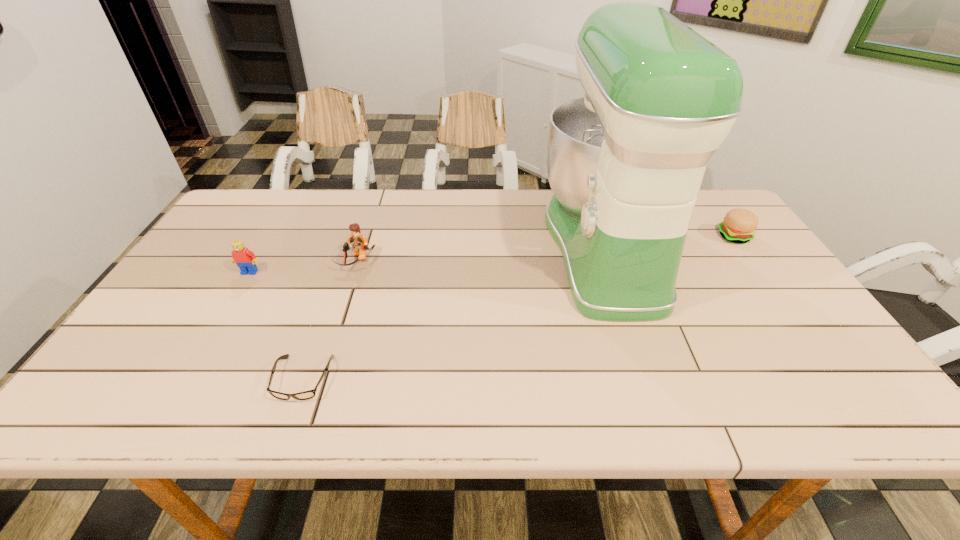
This screenshot has height=540, width=960. I want to click on free space between the tallest object and the leftmost object, so click(x=427, y=260).

Locate an element on the screen. The height and width of the screenshot is (540, 960). free space that is in between the fourth object from left to right and the right Lego is located at coordinates (480, 255).

Locate an element on the screen. The width and height of the screenshot is (960, 540). free space between the right Lego and the leftmost object is located at coordinates (302, 267).

The width and height of the screenshot is (960, 540). In order to click on free area in between the leftmost object and the right Lego in this screenshot , I will do `click(302, 267)`.

Find the location of a particular element. free point between the nearest object and the left Lego is located at coordinates (276, 325).

Identify which object is the fourth nearest to the right Lego. Please provide its 2D coordinates. Your answer should be formatted as a tuple, i.e. [(x, y)], where the tuple contains the x and y coordinates of a point satisfying the conditions above.

[(739, 225)]

Locate an element on the screen. The width and height of the screenshot is (960, 540). object that is the fourth closest to the shortest object is located at coordinates (739, 225).

This screenshot has width=960, height=540. Find the location of `vacant space that satisfies the following two spatial constraints: 1. on the controls of the second object from right to left; 2. on the face of the left Lego`. vacant space that satisfies the following two spatial constraints: 1. on the controls of the second object from right to left; 2. on the face of the left Lego is located at coordinates (612, 272).

Where is `vacant region that satisfies the following two spatial constraints: 1. on the controls of the mixer; 2. holding a crossbow in the hands of the right Lego`? Image resolution: width=960 pixels, height=540 pixels. vacant region that satisfies the following two spatial constraints: 1. on the controls of the mixer; 2. holding a crossbow in the hands of the right Lego is located at coordinates (609, 262).